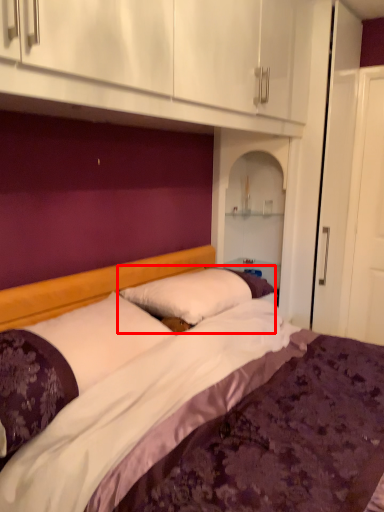
Question: Where is pillow (annotated by the red box) located in relation to pillow in the image?

Choices:
 (A) left
 (B) right

Answer: (B)